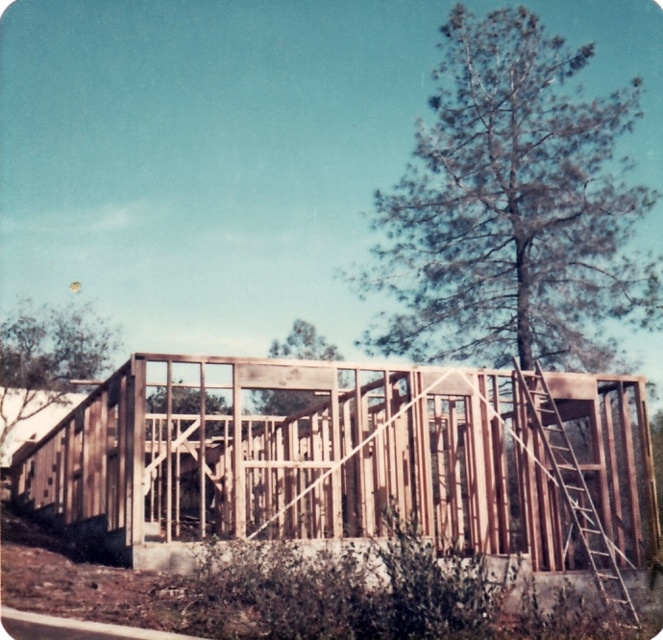
Question: Is brown wooden frame at center below wooden at right?

Choices:
 (A) no
 (B) yes

Answer: (B)

Question: Is green leafy tree at upper center above wooden at right?

Choices:
 (A) no
 (B) yes

Answer: (B)

Question: Among these points, which one is nearest to the camera?

Choices:
 (A) tap(391, 342)
 (B) tap(589, 566)

Answer: (B)

Question: Among these points, which one is farthest from the camera?

Choices:
 (A) (373, 221)
 (B) (591, 544)
 (C) (332, 348)

Answer: (C)

Question: Which point is farther to the camera?

Choices:
 (A) (566, 486)
 (B) (302, 394)
 (C) (78, 316)

Answer: (C)

Question: Is green leafy tree at upper left smaller than wooden at right?

Choices:
 (A) yes
 (B) no

Answer: (A)